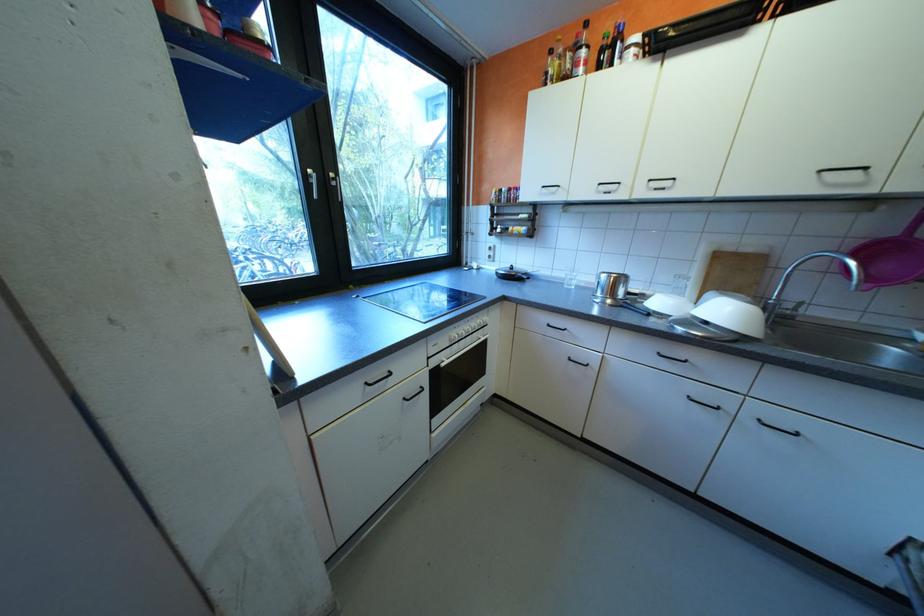
At what (x,y) coordinates should I click in order to perform the action: click on pink plastic colander. Please return your answer as a coordinate pair (x, y). Looking at the image, I should click on (891, 257).